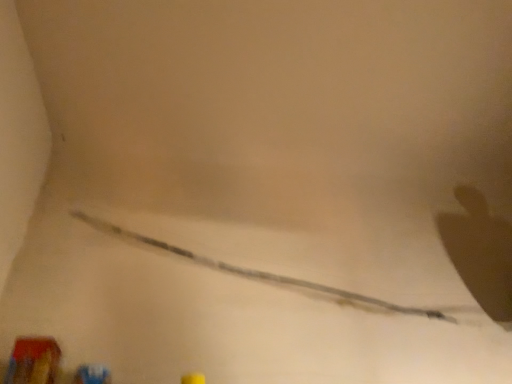
Describe the element at coordinates (33, 361) in the screenshot. I see `rubberized plastic toy at lower left` at that location.

Measure the distance between rubberized plastic toy at lower left and camera.

rubberized plastic toy at lower left is 3.70 feet from camera.

Image resolution: width=512 pixels, height=384 pixels. What are the coordinates of `rubberized plastic toy at lower left` in the screenshot? It's located at (33, 361).

The width and height of the screenshot is (512, 384). Find the location of `rubberized plastic toy at lower left`. rubberized plastic toy at lower left is located at coordinates (33, 361).